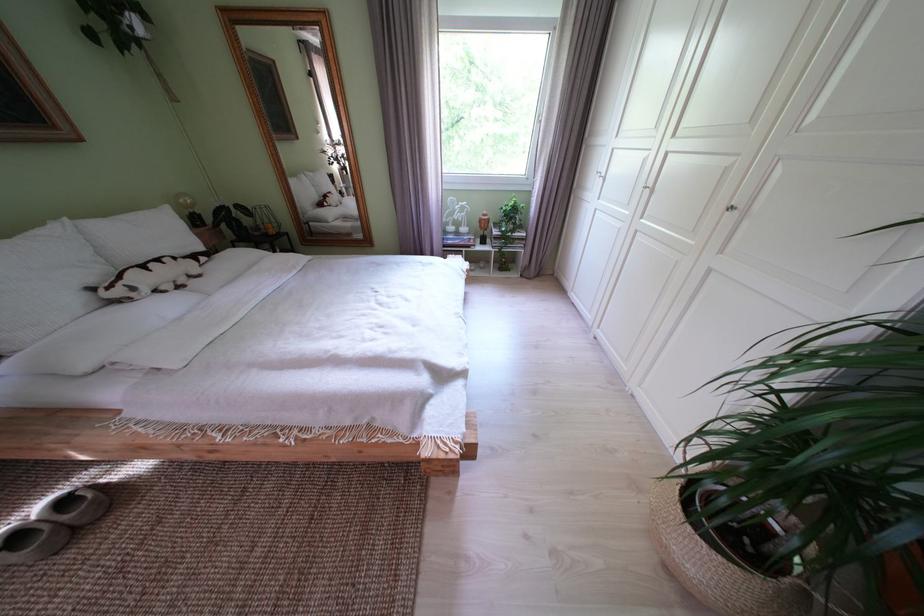
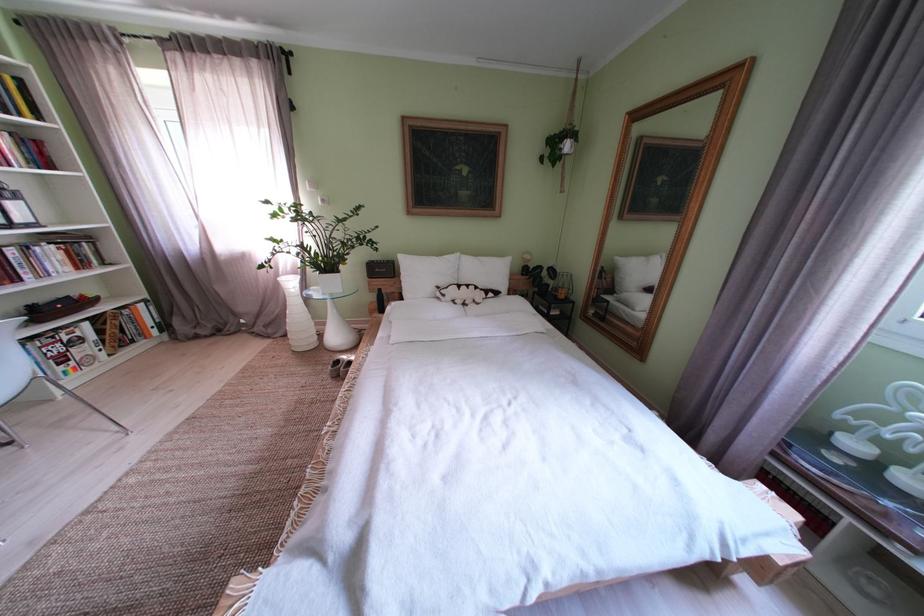
The point at (146,294) is marked in the first image. Where is the corresponding point in the second image?

(455, 301)